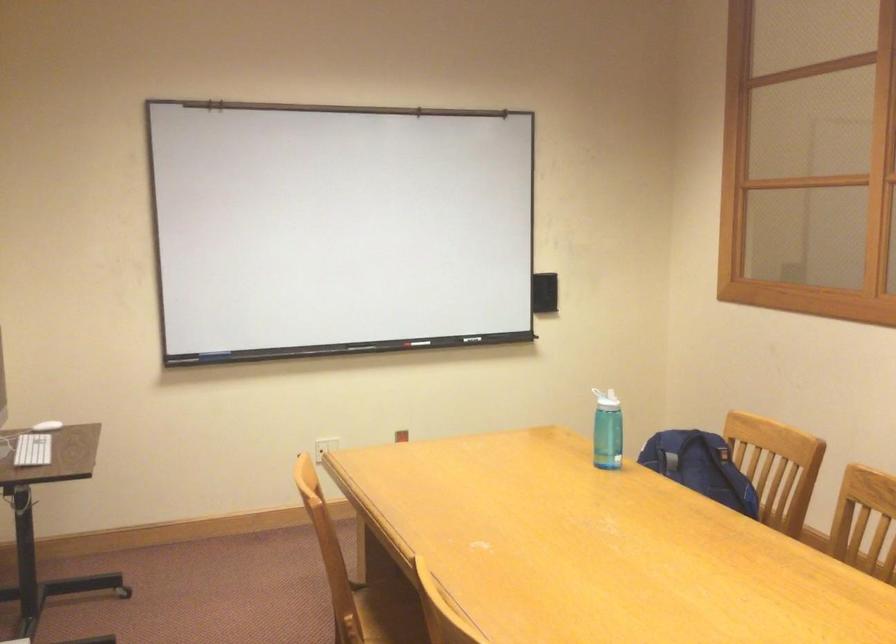
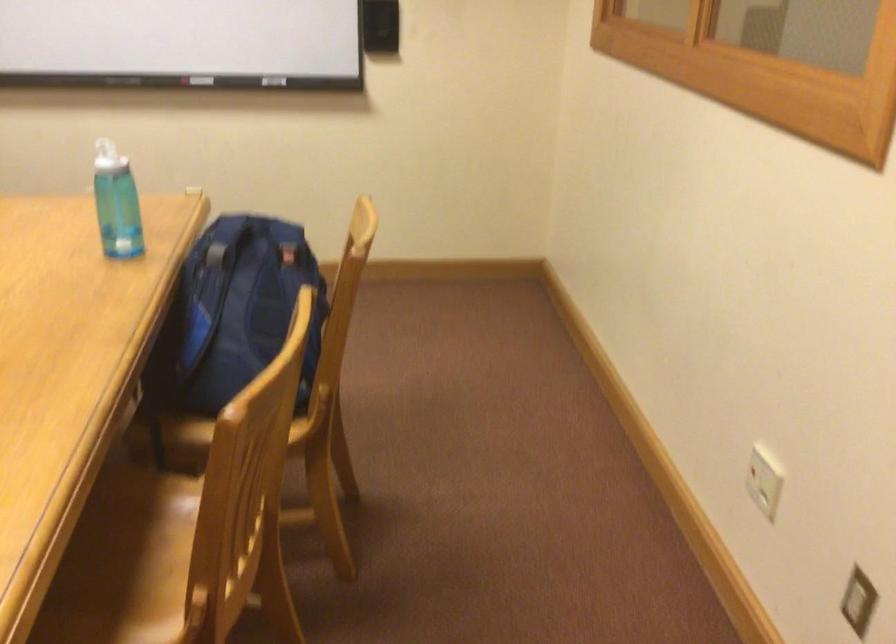
Where in the second image is the point corresponding to the point at 677,440 from the first image?

(254, 225)